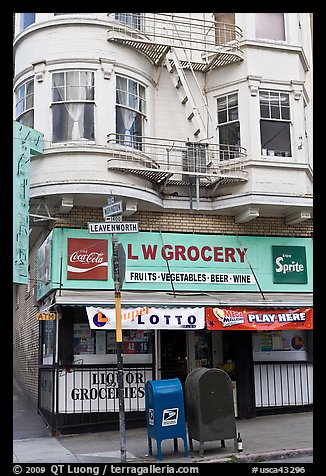
The height and width of the screenshot is (476, 326). What are the coordinates of `neon sign` in the screenshot? It's located at (22, 147), (22, 197), (19, 260).